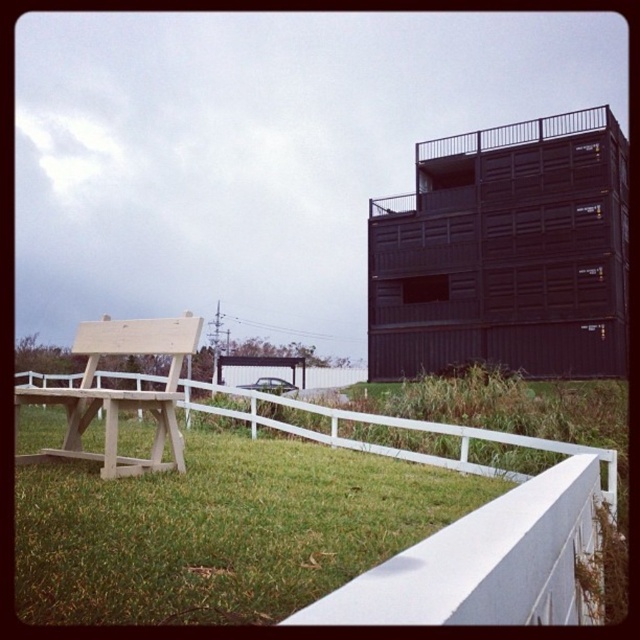
Does green grass at lower left have a lesser height compared to light wood park bench at left?

Correct, green grass at lower left is not as tall as light wood park bench at left.

Between point (291, 490) and point (168, 465), which one is positioned behind?

Positioned behind is point (168, 465).

Where is `green grass at lower left`? green grass at lower left is located at coordinates (221, 531).

Does green grass at lower left have a lesser height compared to white wooden fence at lower center?

Indeed, green grass at lower left has a lesser height compared to white wooden fence at lower center.

Is green grass at lower left closer to the viewer compared to white wooden fence at lower center?

That is True.

Describe the element at coordinates (221, 531) in the screenshot. Image resolution: width=640 pixels, height=640 pixels. I see `green grass at lower left` at that location.

Where is `green grass at lower left`? The height and width of the screenshot is (640, 640). green grass at lower left is located at coordinates (221, 531).

Looking at this image, does white wooden fence at lower center appear under light wood park bench at left?

Yes, white wooden fence at lower center is below light wood park bench at left.

Can you confirm if white wooden fence at lower center is bigger than light wood park bench at left?

Yes, white wooden fence at lower center is bigger than light wood park bench at left.

Is point (337, 419) positioned before point (76, 419)?

No, (337, 419) is further to viewer.

Locate an element on the screen. The width and height of the screenshot is (640, 640). white wooden fence at lower center is located at coordinates (401, 435).